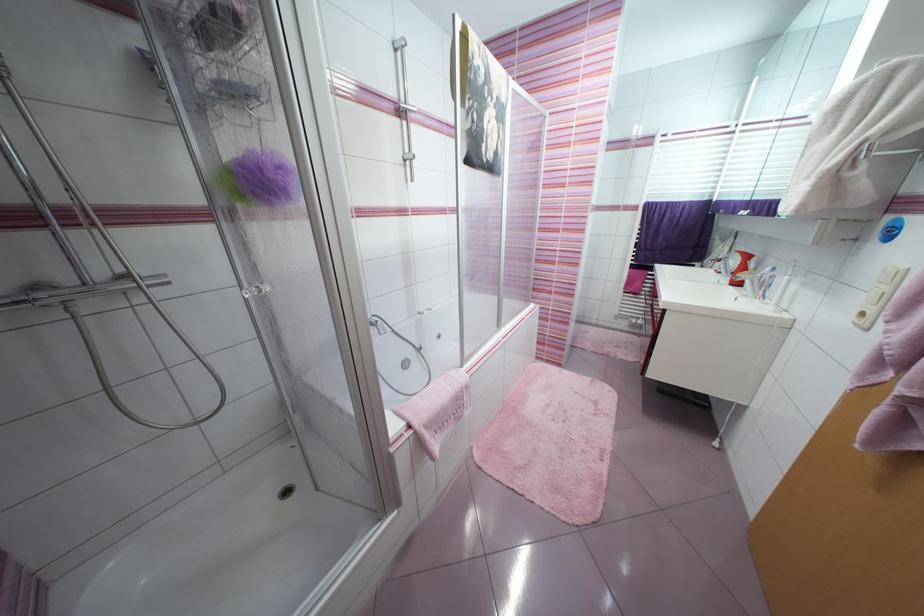
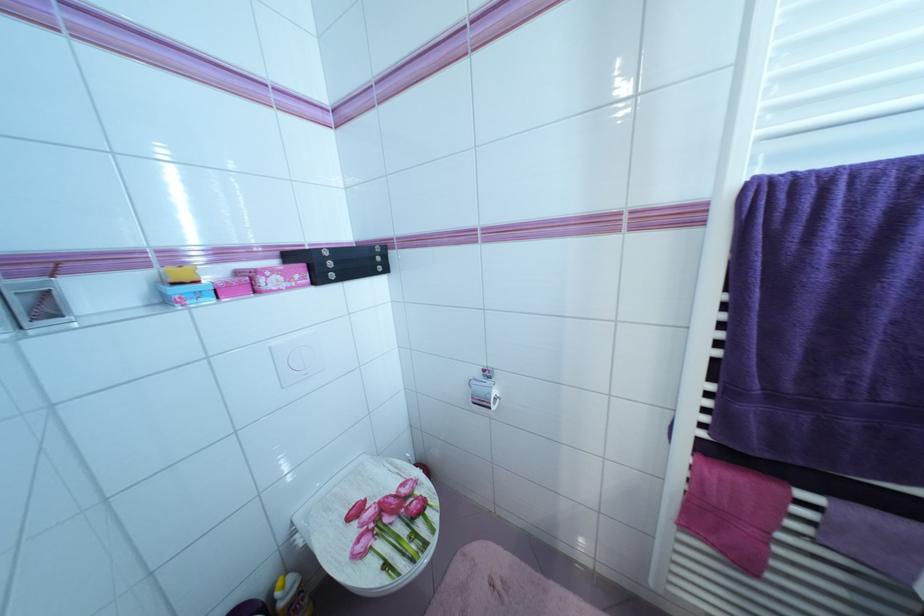
Which direction would the cameraman need to move to produce the second image?

The cameraman moved toward right, forward.